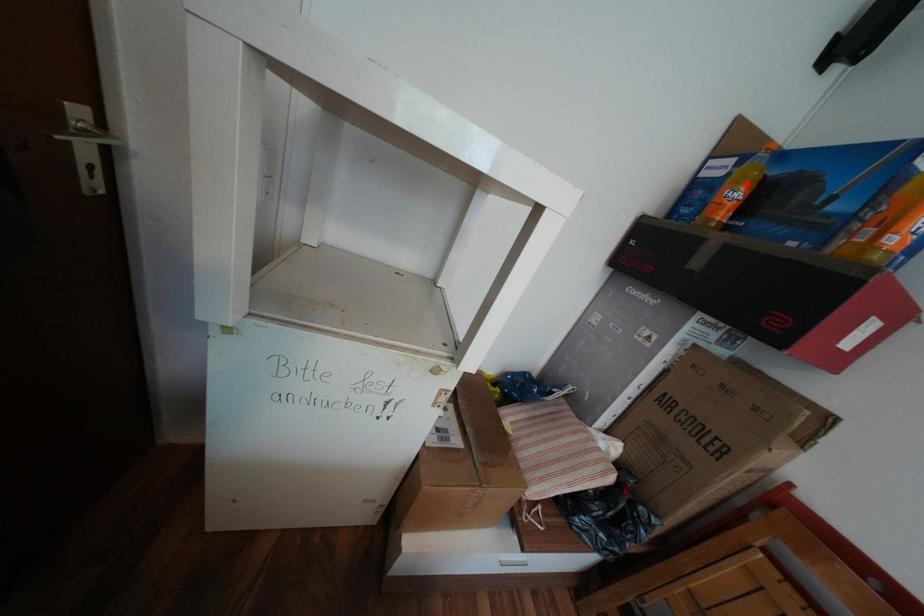
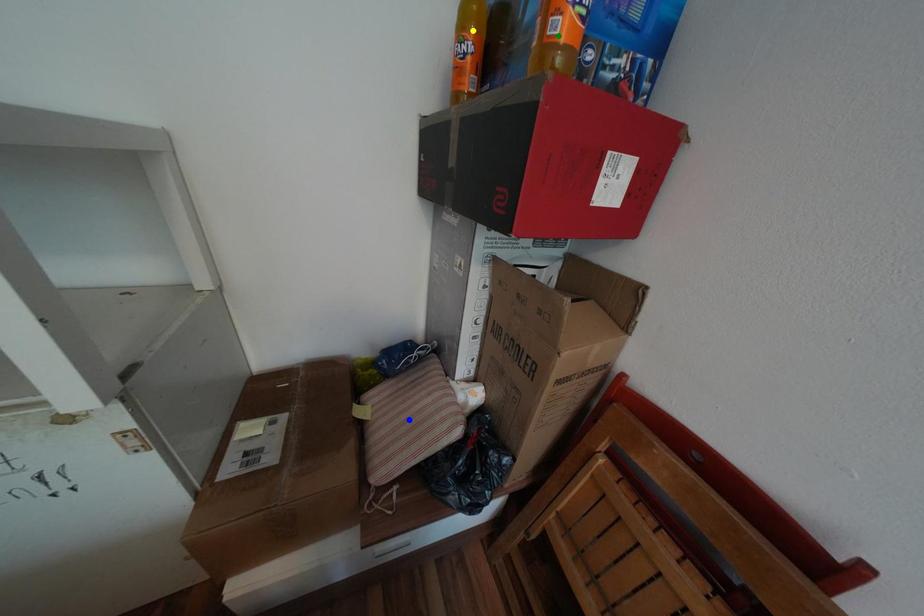
Question: I am providing you with two images of the same scene from different viewpoints. A red point is marked on the first image. You are given multiple points on the second image. Which spot in image 2 lines up with the point in image 1?

Choices:
 (A) blue point
 (B) yellow point
 (C) green point

Answer: (B)